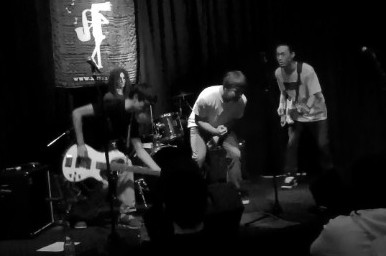
This screenshot has height=256, width=386. I want to click on stage, so click(x=297, y=195).